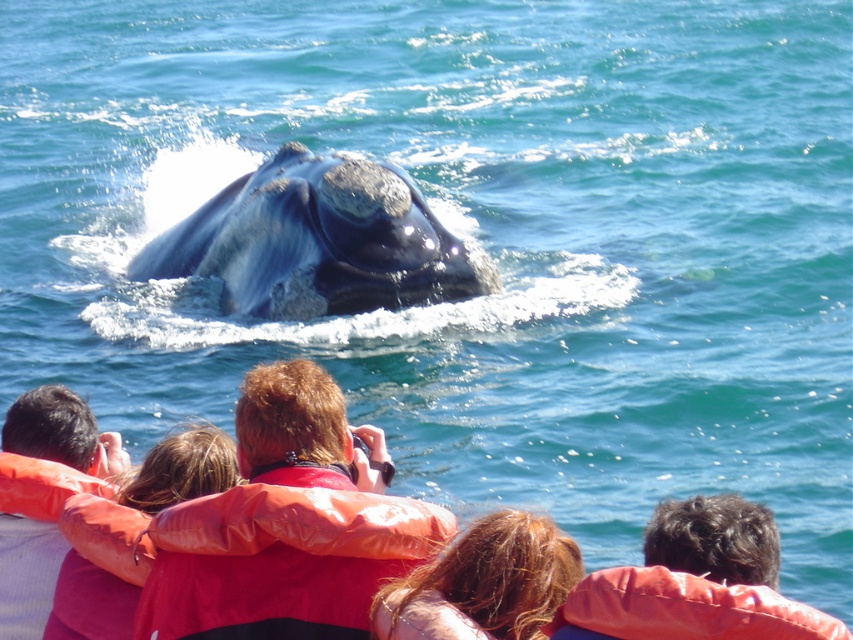
Question: Among these objects, which one is farthest from the camera?

Choices:
 (A) orange life jacket at lower left
 (B) red life vest at center

Answer: (A)

Question: Does gray matte whale at center come in front of orange life vest at lower left?

Choices:
 (A) yes
 (B) no

Answer: (B)

Question: Considering the real-world distances, which object is farthest from the blonde hair at center?

Choices:
 (A) orange life jacket at center
 (B) red leather jacket at center
 (C) gray matte whale at center
 (D) orange synthetic life jacket at lower right

Answer: (C)

Question: Does gray matte whale at center have a lesser width compared to orange life vest at lower left?

Choices:
 (A) no
 (B) yes

Answer: (A)

Question: Which of the following is the closest to the observer?

Choices:
 (A) (3, 586)
 (B) (315, 426)
 (C) (445, 577)
 (D) (76, 509)

Answer: (C)

Question: Is red leather jacket at center positioned at the back of red life vest at center?

Choices:
 (A) no
 (B) yes

Answer: (B)